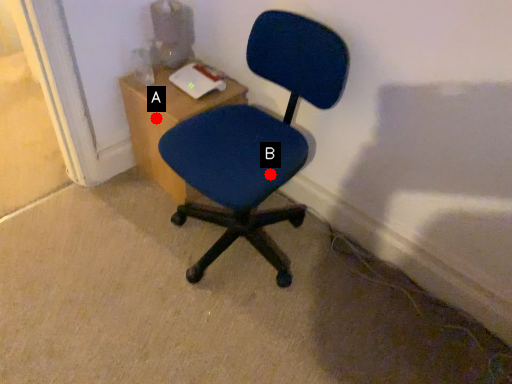
Question: Two points are circled on the image, labeled by A and B beside each circle. Among these points, which one is nearest to the camera?

Choices:
 (A) A is closer
 (B) B is closer

Answer: (B)